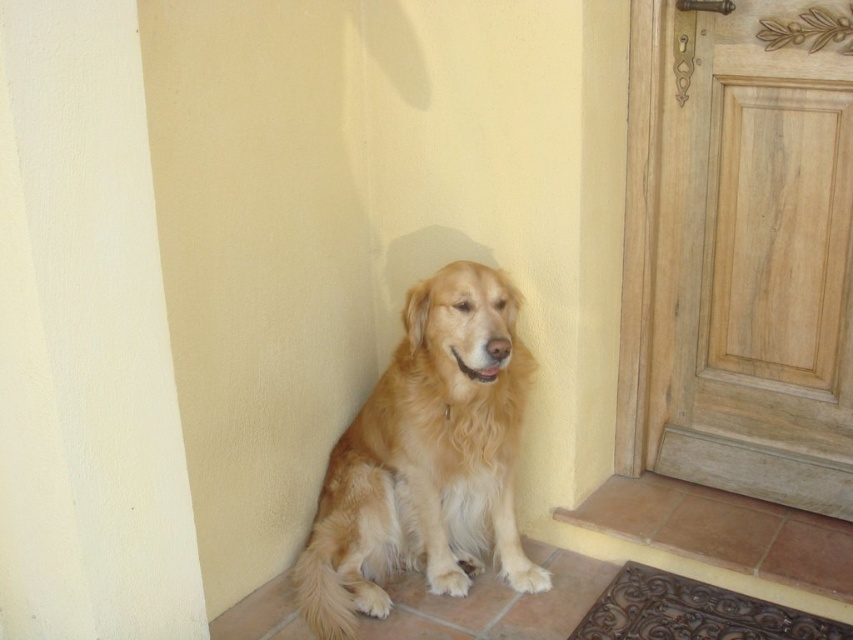
You are standing in front of the golden retriever on the porch. You notice two points marked on the wall behind the dog. The first point is at coordinate (759, 241) and the second is at (469, 509). Which point is closer to you?

Point (759, 241) is closer to you because it is further to the viewer than point (469, 509).

You are a delivery person trying to enter the house through the light brown wood door at right. The golden fur dog at center is blocking the path. Can you pass through the door without moving the dog?

The light brown wood door at right is thinner than the golden fur dog at center, so the door is narrower than the dog. Since the dog is blocking the path and the door is too narrow, you cannot pass through without moving the dog.